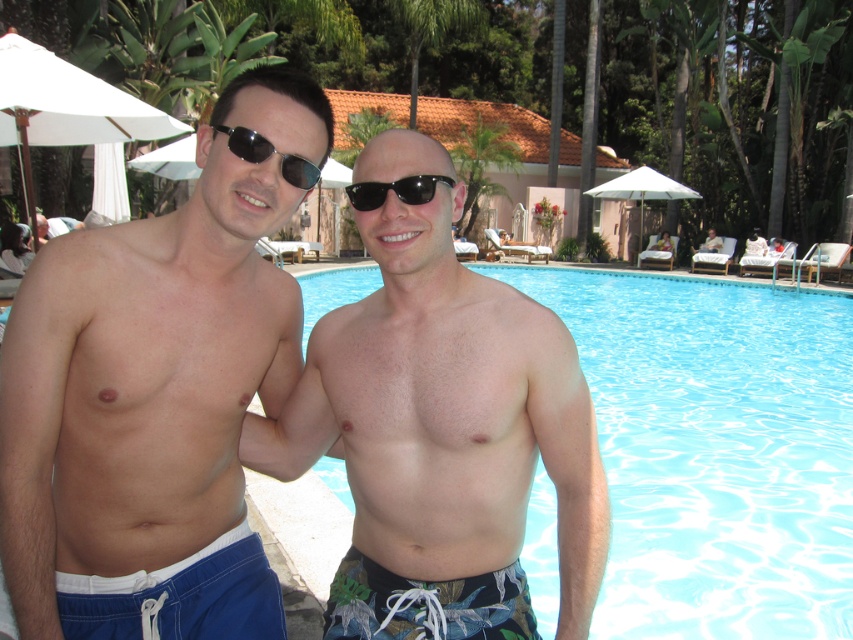
Question: Is blue fabric shorts at left thinner than black reflective sunglasses at left?

Choices:
 (A) no
 (B) yes

Answer: (A)

Question: Can you confirm if blue fabric shorts at left is wider than black reflective sunglasses at left?

Choices:
 (A) no
 (B) yes

Answer: (B)

Question: Based on their relative distances, which object is farther from the black reflective sunglasses at left?

Choices:
 (A) multicolored fabric shorts at center
 (B) black plastic sunglasses at center
 (C) transparent blue water at center

Answer: (C)

Question: Which object is the closest to the multicolored fabric shorts at center?

Choices:
 (A) blue fabric shorts at left
 (B) black reflective sunglasses at left
 (C) black plastic sunglasses at center

Answer: (A)

Question: Is multicolored fabric shorts at center to the left of transparent blue water at center from the viewer's perspective?

Choices:
 (A) yes
 (B) no

Answer: (A)

Question: Which of the following is the closest to the observer?

Choices:
 (A) black reflective sunglasses at left
 (B) black plastic sunglasses at center

Answer: (A)